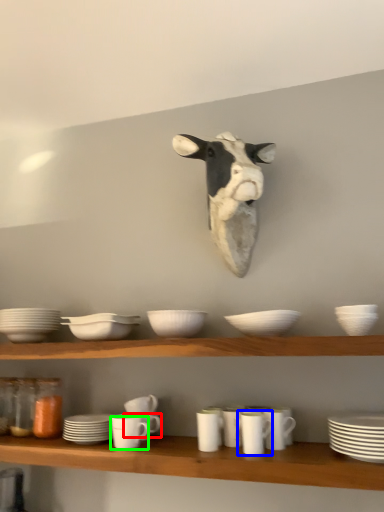
Question: Which object is the farthest from tableware (highlighted by a red box)? Choose among these: tableware (highlighted by a blue box) or tableware (highlighted by a green box).

Choices:
 (A) tableware
 (B) tableware

Answer: (A)